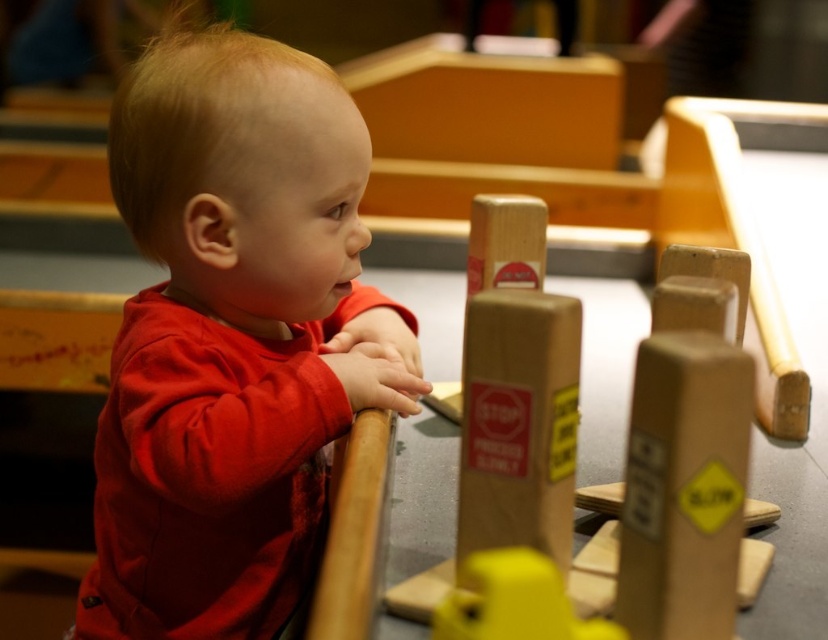
Question: Does red matte shirt at left appear under wooden sign at center?

Choices:
 (A) yes
 (B) no

Answer: (A)

Question: Which point appears farthest from the camera in this image?

Choices:
 (A) (272, 216)
 (B) (499, 212)

Answer: (B)

Question: Is red matte shirt at left bigger than wooden sign at center?

Choices:
 (A) yes
 (B) no

Answer: (A)

Question: Is red matte shirt at left to the left of wooden sign at center from the viewer's perspective?

Choices:
 (A) no
 (B) yes

Answer: (B)

Question: Which of the following is the farthest from the observer?

Choices:
 (A) red matte shirt at left
 (B) wooden sign at center

Answer: (B)